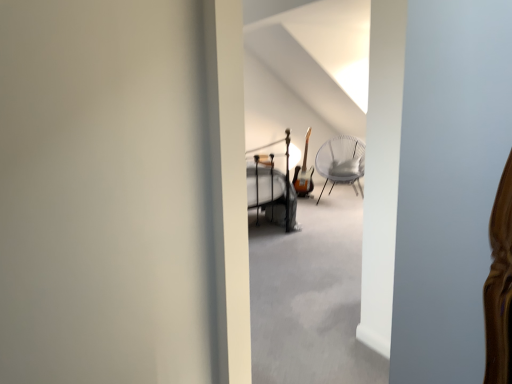
Question: Considering the relative positions of metallic silver bunk bed at center and white wicker chair at center in the image provided, is metallic silver bunk bed at center to the left of white wicker chair at center from the viewer's perspective?

Choices:
 (A) yes
 (B) no

Answer: (A)

Question: From a real-world perspective, is metallic silver bunk bed at center physically above white wicker chair at center?

Choices:
 (A) yes
 (B) no

Answer: (A)

Question: Is metallic silver bunk bed at center completely or partially outside of white wicker chair at center?

Choices:
 (A) yes
 (B) no

Answer: (A)

Question: From the image's perspective, is metallic silver bunk bed at center under white wicker chair at center?

Choices:
 (A) yes
 (B) no

Answer: (A)

Question: From a real-world perspective, is metallic silver bunk bed at center below white wicker chair at center?

Choices:
 (A) yes
 (B) no

Answer: (B)

Question: Considering the relative sizes of metallic silver bunk bed at center and white wicker chair at center in the image provided, is metallic silver bunk bed at center thinner than white wicker chair at center?

Choices:
 (A) no
 (B) yes

Answer: (A)

Question: Is white wicker chair at center thinner than metallic silver bunk bed at center?

Choices:
 (A) no
 (B) yes

Answer: (B)

Question: Is white wicker chair at center facing away from metallic silver bunk bed at center?

Choices:
 (A) no
 (B) yes

Answer: (A)

Question: Does white wicker chair at center turn towards metallic silver bunk bed at center?

Choices:
 (A) yes
 (B) no

Answer: (B)

Question: Is white wicker chair at center bigger than metallic silver bunk bed at center?

Choices:
 (A) yes
 (B) no

Answer: (B)

Question: Does white wicker chair at center have a greater height compared to metallic silver bunk bed at center?

Choices:
 (A) no
 (B) yes

Answer: (A)

Question: Considering the relative sizes of white wicker chair at center and metallic silver bunk bed at center in the image provided, is white wicker chair at center shorter than metallic silver bunk bed at center?

Choices:
 (A) no
 (B) yes

Answer: (B)

Question: Considering the positions of white wicker chair at center and metallic silver bunk bed at center in the image, is white wicker chair at center bigger or smaller than metallic silver bunk bed at center?

Choices:
 (A) small
 (B) big

Answer: (A)